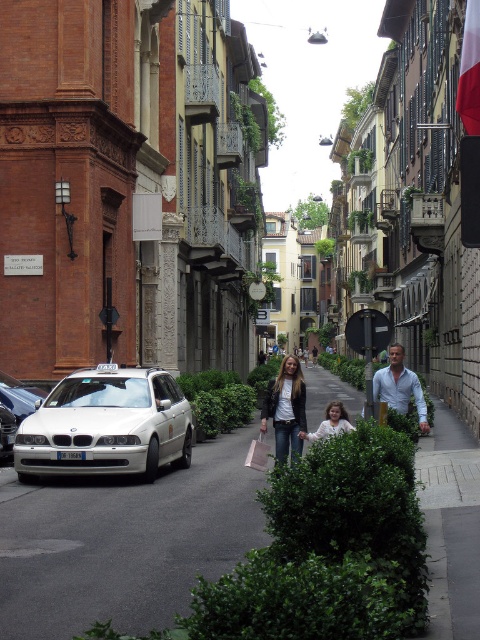
Can you confirm if gray asphalt pavement at center is shorter than white matte shirt at center?

Yes.

Find the location of a particular element. gray asphalt pavement at center is located at coordinates (123, 541).

Image resolution: width=480 pixels, height=640 pixels. I want to click on gray asphalt pavement at center, so click(x=123, y=541).

Who is positioned more to the left, white fabric flag at upper right or silver metallic car at center?

silver metallic car at center

Which is in front, point (468, 20) or point (25, 406)?

Point (468, 20)

Who is more forward, [477,16] or [22,385]?

Positioned in front is point [477,16].

You are a GUI agent. You are given a task and a screenshot of the screen. Output one action in this format:
    pyautogui.click(x=<x>, y=<y>)
    Task: Click on the white fabric flag at upper right
    
    Given the screenshot: What is the action you would take?
    pyautogui.click(x=469, y=70)

Looking at this image, does gray asphalt pavement at center have a smaller size compared to denim jacket at center?

No, gray asphalt pavement at center is not smaller than denim jacket at center.

Between gray asphalt pavement at center and denim jacket at center, which one appears on the left side from the viewer's perspective?

From the viewer's perspective, denim jacket at center appears more on the left side.

Between point (75, 605) and point (298, 406), which one is positioned behind?

Point (298, 406)

In order to click on gray asphalt pavement at center in this screenshot , I will do `click(123, 541)`.